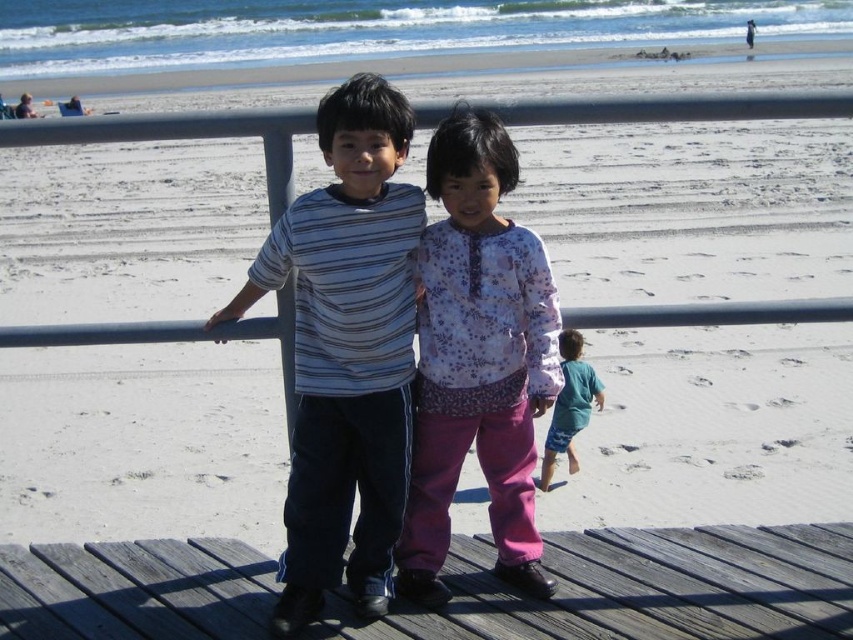
You are a photographer trying to capture both the striped cotton shirt at center and the teal fabric shorts at lower right in a single frame. Since you want to emphasize the height difference between them, which object should you position closer to the camera to achieve this effect?

To emphasize the height difference between the striped cotton shirt at center and the teal fabric shorts at lower right, you should position the striped cotton shirt at center closer to the camera since it has a greater height compared to the teal fabric shorts at lower right.